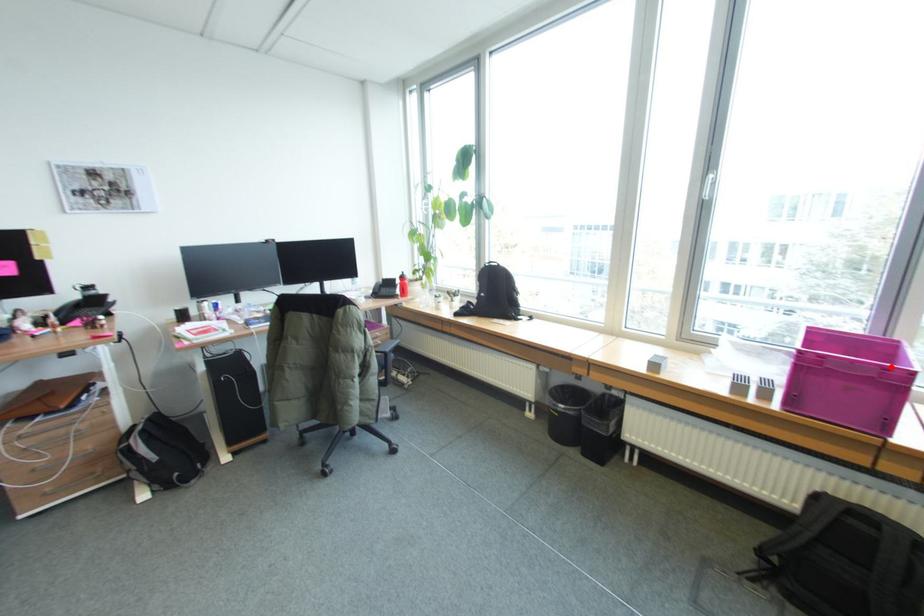
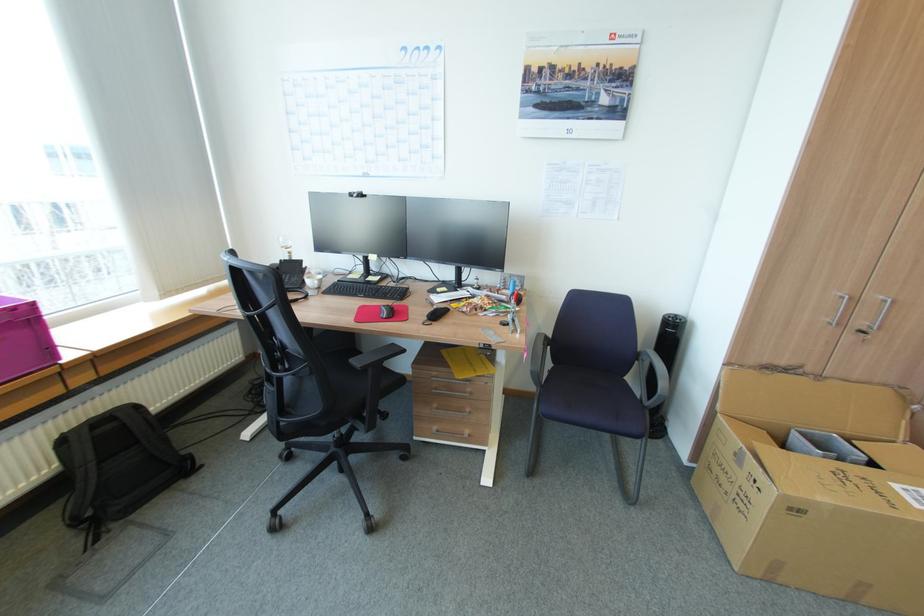
In the second image, find the point that corresponds to the highlighted location in the first image.

(21, 309)